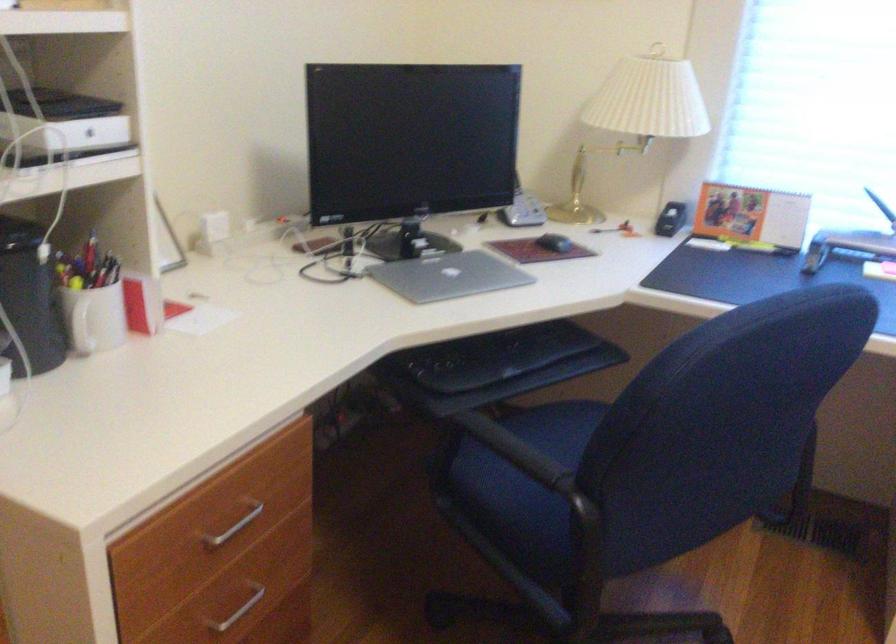
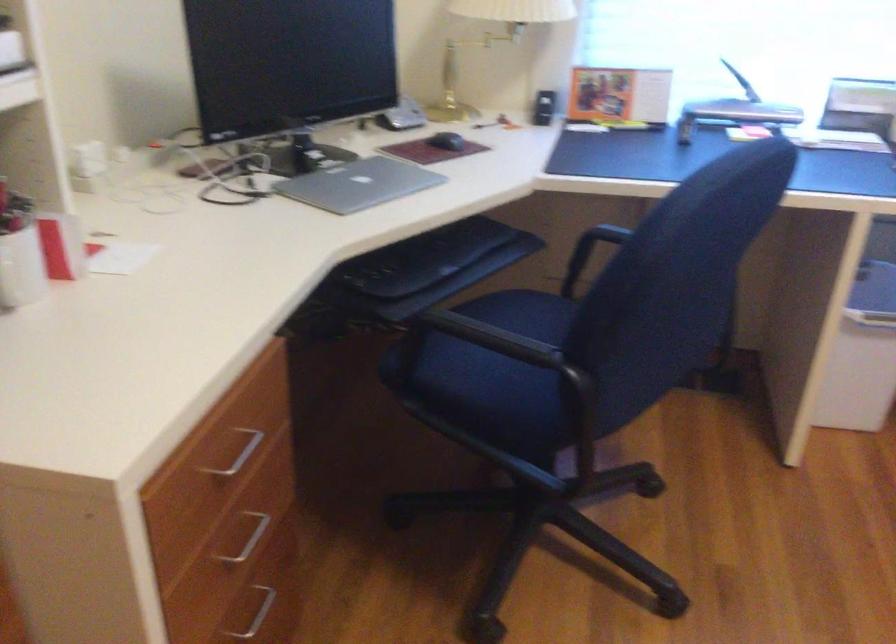
Question: The images are taken continuously from a first-person perspective. In which direction is your viewpoint rotating?

Choices:
 (A) Left
 (B) Right
 (C) Up
 (D) Down

Answer: (B)